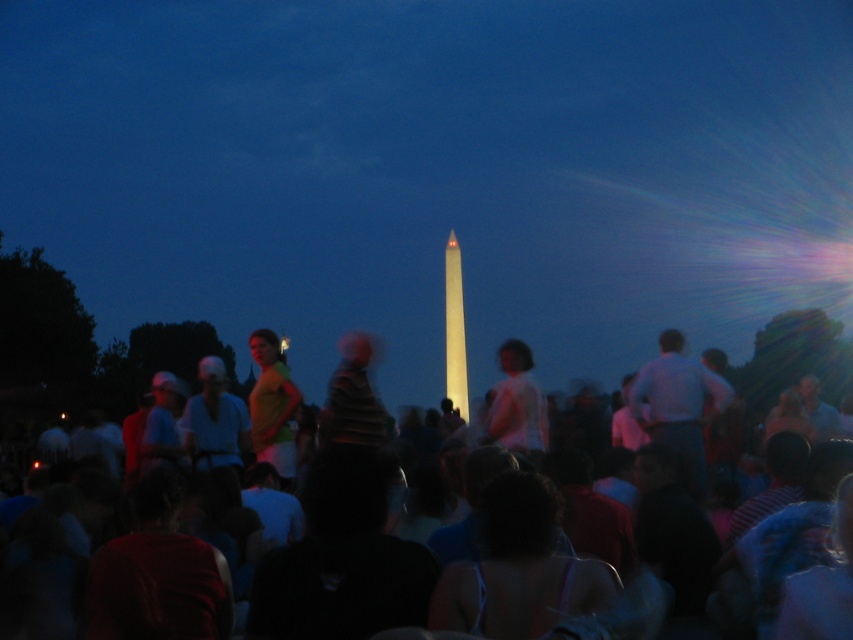
Question: Which of the following is the farthest from the observer?

Choices:
 (A) yellow fabric shirt at center
 (B) white marble monument at center
 (C) white matte shirt at center
 (D) white polished stone obelisk at center

Answer: (D)

Question: Can you confirm if white matte shirt at center is thinner than white polished stone obelisk at center?

Choices:
 (A) yes
 (B) no

Answer: (B)

Question: Is the position of white marble monument at center less distant than that of black cotton crowd at center?

Choices:
 (A) yes
 (B) no

Answer: (B)

Question: Can you confirm if white marble monument at center is wider than yellow fabric shirt at center?

Choices:
 (A) yes
 (B) no

Answer: (A)

Question: Which point is farther from the camera taking this photo?

Choices:
 (A) (292, 179)
 (B) (447, 328)
 (C) (281, 458)
 (D) (518, 420)

Answer: (A)

Question: Which of the following is the farthest from the observer?

Choices:
 (A) white polished stone obelisk at center
 (B) white matte shirt at center
 (C) yellow fabric shirt at center

Answer: (A)